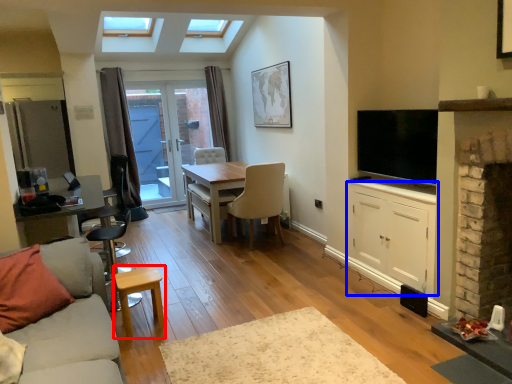
Question: Among these objects, which one is nearest to the camera, stool (highlighted by a red box) or cabinetry (highlighted by a blue box)?

Choices:
 (A) stool
 (B) cabinetry

Answer: (A)